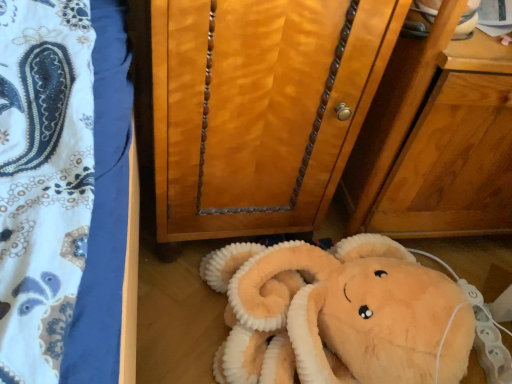
Question: From a real-world perspective, is wooden cabinet at center over soft plush toy at lower center?

Choices:
 (A) yes
 (B) no

Answer: (A)

Question: Is the position of wooden cabinet at center more distant than that of soft plush toy at lower center?

Choices:
 (A) yes
 (B) no

Answer: (B)

Question: Is wooden cabinet at center beside soft plush toy at lower center?

Choices:
 (A) no
 (B) yes

Answer: (A)

Question: Is wooden cabinet at center taller than soft plush toy at lower center?

Choices:
 (A) no
 (B) yes

Answer: (B)

Question: Does wooden cabinet at center have a lesser height compared to soft plush toy at lower center?

Choices:
 (A) yes
 (B) no

Answer: (B)

Question: Is wooden cabinet at center far away from soft plush toy at lower center?

Choices:
 (A) no
 (B) yes

Answer: (A)

Question: Is soft plush toy at lower center bigger than wooden cabinet at center?

Choices:
 (A) yes
 (B) no

Answer: (B)

Question: Considering the relative sizes of soft plush toy at lower center and wooden cabinet at center in the image provided, is soft plush toy at lower center shorter than wooden cabinet at center?

Choices:
 (A) yes
 (B) no

Answer: (A)

Question: Does soft plush toy at lower center have a smaller size compared to wooden cabinet at center?

Choices:
 (A) no
 (B) yes

Answer: (B)

Question: Are soft plush toy at lower center and wooden cabinet at center located far from each other?

Choices:
 (A) no
 (B) yes

Answer: (A)

Question: Considering the relative positions of soft plush toy at lower center and wooden cabinet at center in the image provided, is soft plush toy at lower center to the right of wooden cabinet at center from the viewer's perspective?

Choices:
 (A) no
 (B) yes

Answer: (B)

Question: Is soft plush toy at lower center at the left side of wooden cabinet at center?

Choices:
 (A) yes
 (B) no

Answer: (B)

Question: In the image, is wooden cabinet at center positioned in front of or behind soft plush toy at lower center?

Choices:
 (A) behind
 (B) front

Answer: (B)